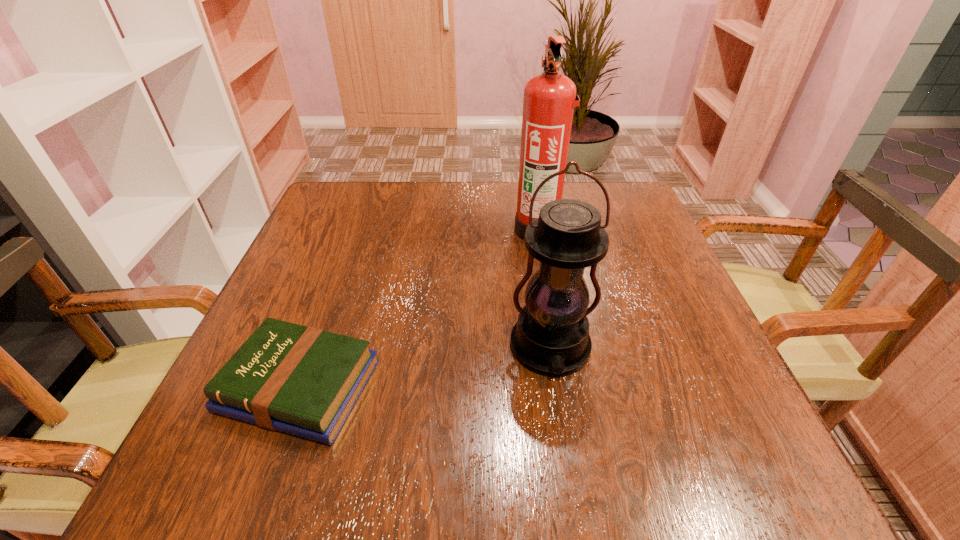
At what (x,y) coordinates should I click in order to perform the action: click on object present at the far edge. Please return your answer as a coordinate pair (x, y). This screenshot has width=960, height=540. Looking at the image, I should click on (549, 98).

The width and height of the screenshot is (960, 540). I want to click on object located at the near edge, so click(x=304, y=381).

The width and height of the screenshot is (960, 540). What are the coordinates of `object situated at the left edge` in the screenshot? It's located at (304, 381).

Locate an element on the screen. This screenshot has height=540, width=960. object that is at the near left corner is located at coordinates (304, 381).

In the image, there is a desktop. Where is `free space at the far edge`? This screenshot has width=960, height=540. free space at the far edge is located at coordinates (396, 190).

Where is `free space at the near edge of the desktop`? This screenshot has width=960, height=540. free space at the near edge of the desktop is located at coordinates (405, 486).

The image size is (960, 540). What are the coordinates of `free space at the left edge of the desktop` in the screenshot? It's located at (293, 315).

Where is `free space at the far left corner`? Image resolution: width=960 pixels, height=540 pixels. free space at the far left corner is located at coordinates (331, 227).

Identify the location of vacant position at the far right corner of the desktop. Image resolution: width=960 pixels, height=540 pixels. point(620,210).

This screenshot has width=960, height=540. Identify the location of free space between the shortest object and the tallest object. (419, 308).